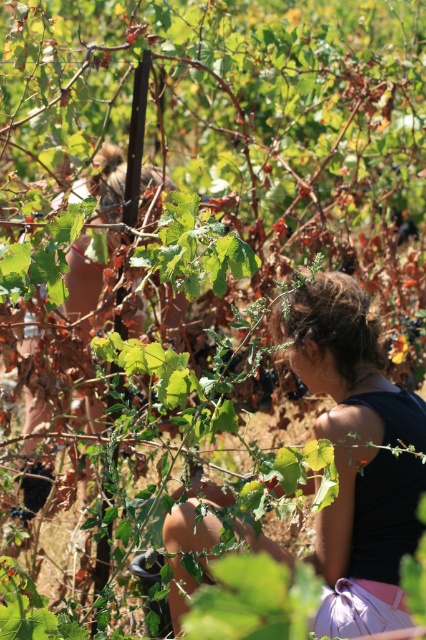
Question: Where is dark brown hair at center located in relation to matte brown hair at center in the image?

Choices:
 (A) left
 (B) right

Answer: (B)

Question: Can you confirm if dark brown hair at center is smaller than matte brown hair at center?

Choices:
 (A) no
 (B) yes

Answer: (B)

Question: Can you confirm if dark brown hair at center is wider than matte brown hair at center?

Choices:
 (A) yes
 (B) no

Answer: (A)

Question: Which point is farther from the camera taking this photo?

Choices:
 (A) (397, 502)
 (B) (31, 481)

Answer: (B)

Question: Which point is farther to the camera?

Choices:
 (A) matte brown hair at center
 (B) dark brown hair at center

Answer: (A)